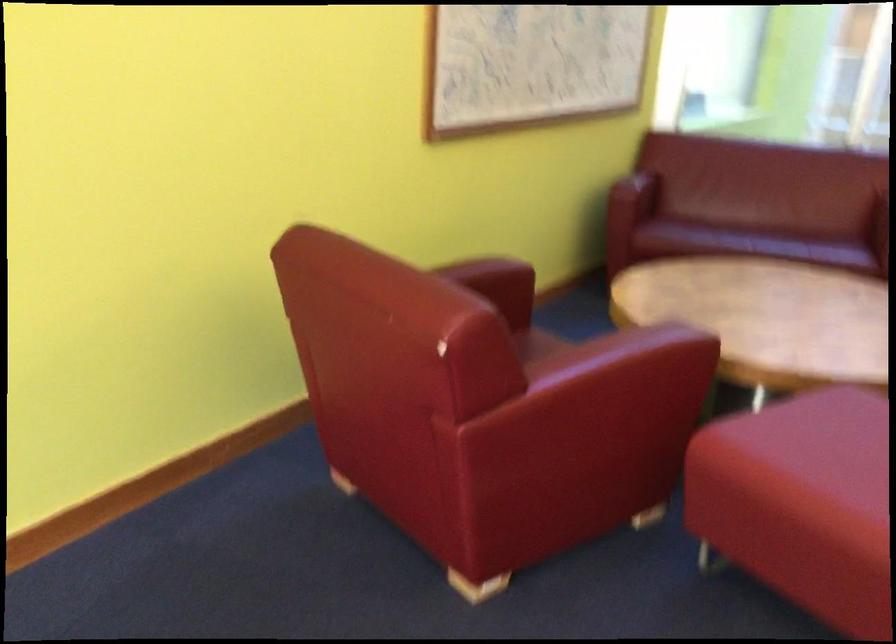
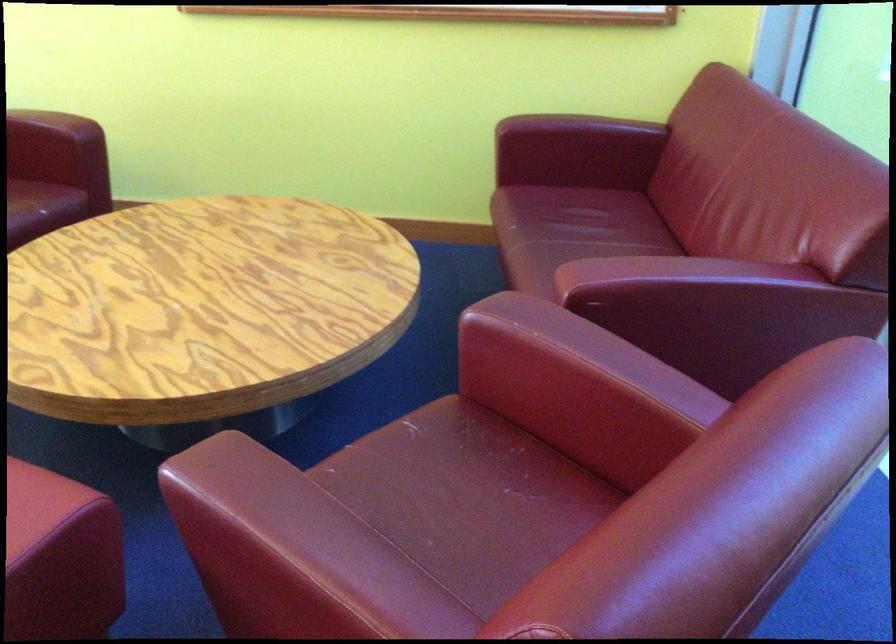
Where in the second image is the point corresponding to (x=693, y=216) from the first image?

(592, 210)